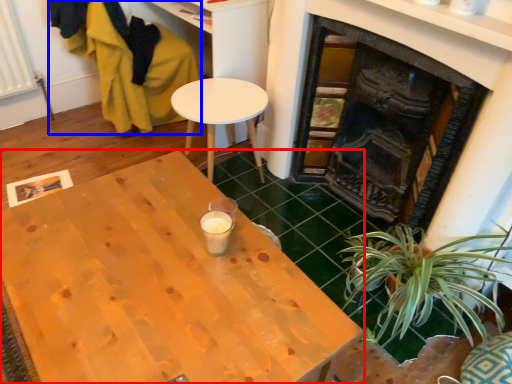
Question: Which of the following is the closest to the observer, desk (highlighted by a red box) or swivel chair (highlighted by a blue box)?

Choices:
 (A) desk
 (B) swivel chair

Answer: (A)